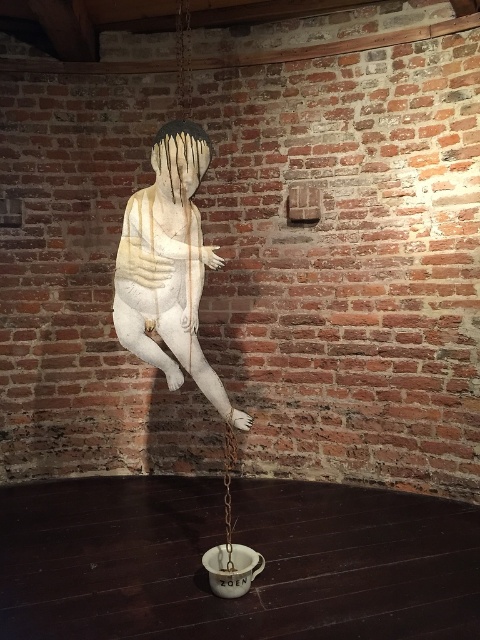
Question: Can you confirm if white matte sculpture at center is positioned below white matte swing at center?

Choices:
 (A) no
 (B) yes

Answer: (A)

Question: Which of the following is the closest to the observer?

Choices:
 (A) white matte swing at center
 (B) white matte sculpture at center

Answer: (B)

Question: Does white matte sculpture at center appear on the left side of white matte swing at center?

Choices:
 (A) no
 (B) yes

Answer: (B)

Question: Is white matte sculpture at center thinner than white matte swing at center?

Choices:
 (A) no
 (B) yes

Answer: (A)